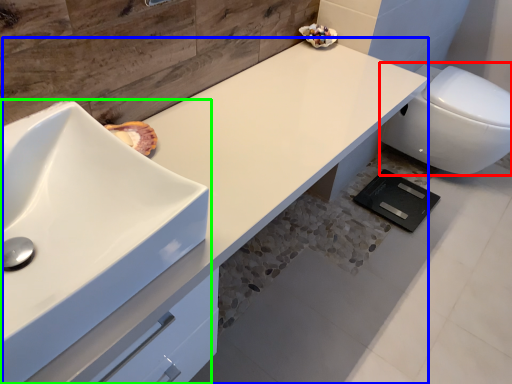
Question: Based on their relative distances, which object is farther from toilet (highlighted by a red box)? Choose from counter top (highlighted by a blue box) and sink (highlighted by a green box).

Choices:
 (A) counter top
 (B) sink

Answer: (B)